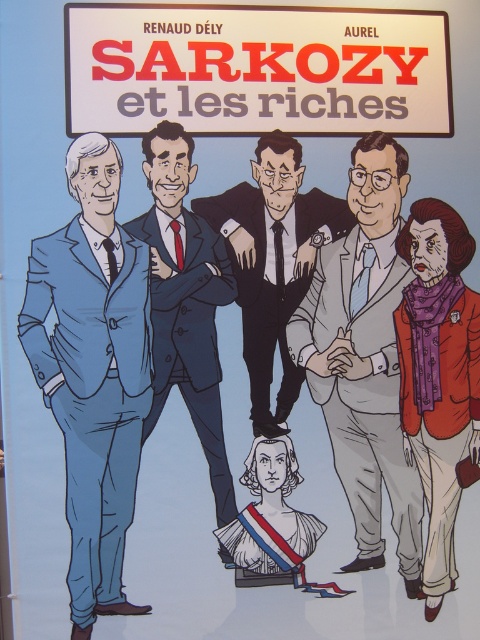
Can you confirm if blue suit at center is positioned below smooth black suit at center?

Yes, blue suit at center is below smooth black suit at center.

From the picture: Between blue suit at center and smooth black suit at center, which one is positioned higher?

smooth black suit at center is above.

Is point (165, 269) behind point (265, 292)?

No.

What are the coordinates of `blue suit at center` in the screenshot? It's located at (186, 300).

Does point (91, 563) come in front of point (320, 529)?

That is True.

Identify the location of blue fabric suit at left. This screenshot has height=640, width=480. (93, 371).

Can you confirm if light gray suit at center is positioned below smooth black suit at center?

Yes, light gray suit at center is below smooth black suit at center.

Is light gray suit at center positioned in front of smooth black suit at center?

No, it is behind smooth black suit at center.

Find the location of `light gray suit at center`. light gray suit at center is located at coordinates (363, 356).

This screenshot has width=480, height=640. I want to click on light gray suit at center, so click(363, 356).